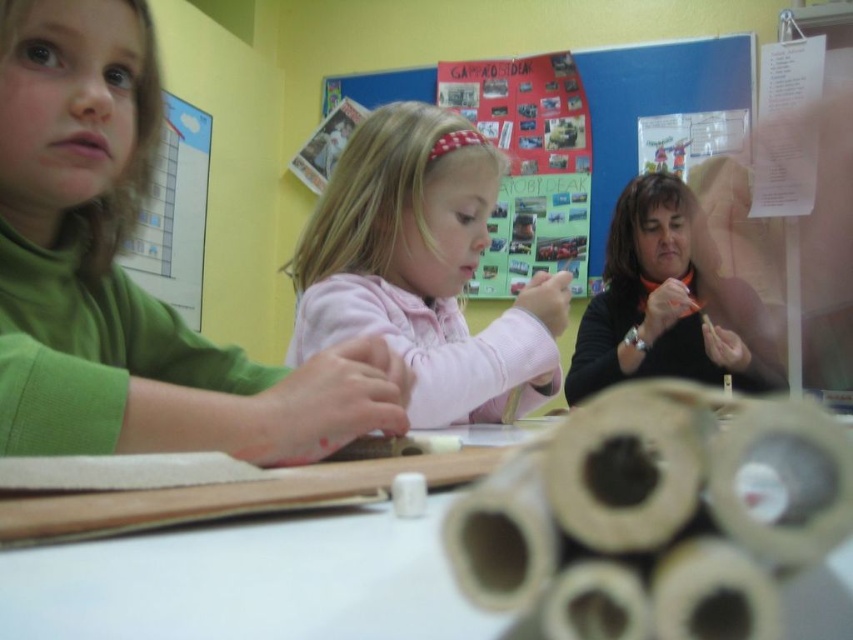
Question: Is green matte shirt at left wider than black matte sweater at upper right?

Choices:
 (A) no
 (B) yes

Answer: (A)

Question: Does green matte shirt at left have a smaller size compared to black matte sweater at upper right?

Choices:
 (A) no
 (B) yes

Answer: (B)

Question: Which point is farther to the camera?

Choices:
 (A) (323, 264)
 (B) (581, 326)

Answer: (B)

Question: Considering the real-world distances, which object is closest to the white cardboard tubes at lower center?

Choices:
 (A) pink fleece jacket at center
 (B) multicolored paper collage at upper center

Answer: (A)

Question: Based on their relative distances, which object is nearer to the white cardboard tubes at lower center?

Choices:
 (A) green matte shirt at left
 (B) pink fleece jacket at center
 (C) black matte sweater at upper right

Answer: (A)

Question: Does green matte shirt at left appear under black matte sweater at upper right?

Choices:
 (A) yes
 (B) no

Answer: (A)